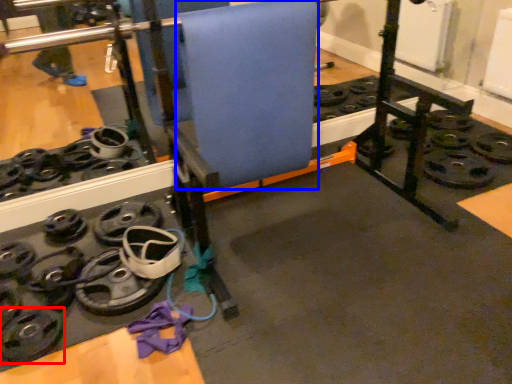
Question: Which object is further to the camera taking this photo, wheel (highlighted by a red box) or yoga mat (highlighted by a blue box)?

Choices:
 (A) wheel
 (B) yoga mat

Answer: (B)